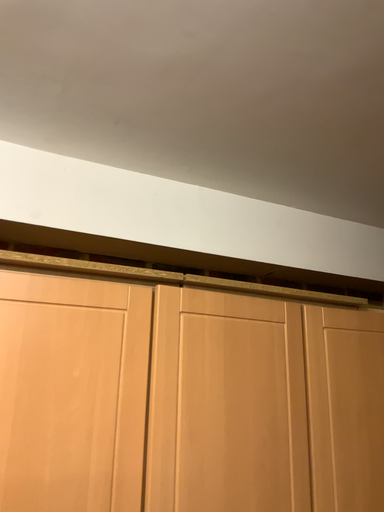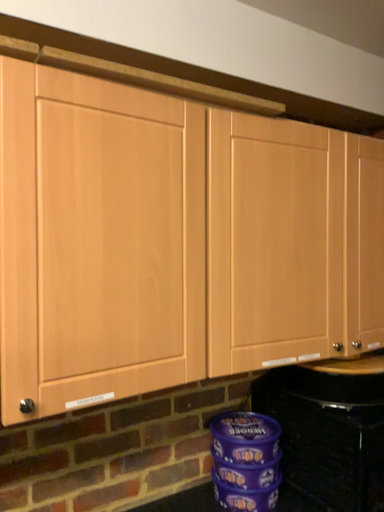
Question: How did the camera likely rotate when shooting the video?

Choices:
 (A) rotated upward
 (B) rotated downward

Answer: (B)